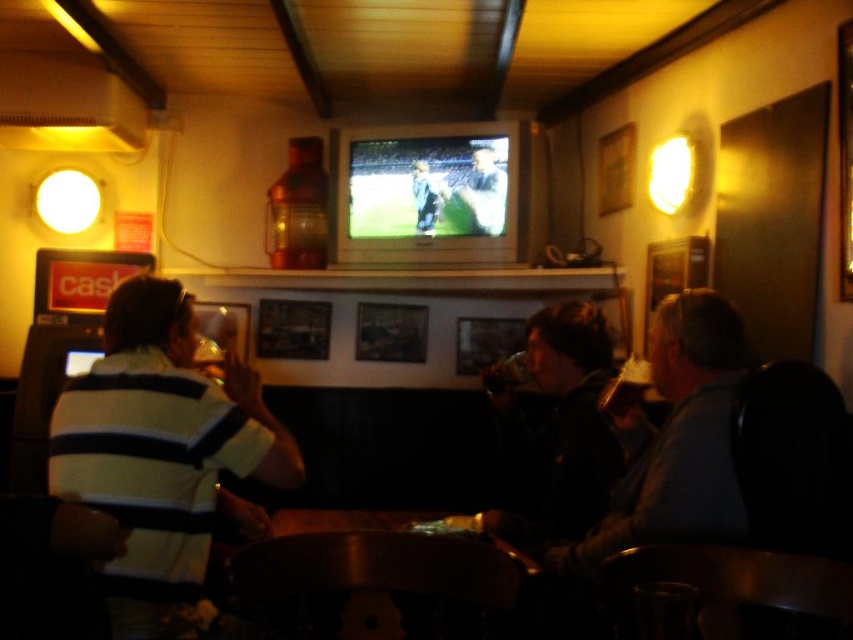
Is striped cotton shirt at left taller than dark blue jersey at center?

Yes, striped cotton shirt at left is taller than dark blue jersey at center.

Is the position of striped cotton shirt at left less distant than that of dark blue jersey at center?

That is True.

Find the location of a particular element. The width and height of the screenshot is (853, 640). striped cotton shirt at left is located at coordinates (161, 454).

From the picture: Can you confirm if wooden table at center is wider than light blue jersey at center?

Yes.

Is wooden table at center in front of light blue jersey at center?

Yes.

Does point (431, 579) come farther from viewer compared to point (486, 177)?

No.

The width and height of the screenshot is (853, 640). I want to click on wooden table at center, so click(376, 570).

Is striped cotton shirt at left further to the viewer compared to light blue jersey at center?

No.

Is point (149, 378) closer to viewer compared to point (502, 173)?

That is True.

Identify the location of striped cotton shirt at left. The height and width of the screenshot is (640, 853). (161, 454).